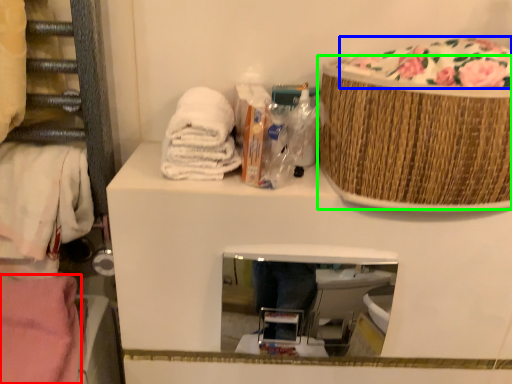
Question: Which object is the closest to the material (highlighted by a red box)? Choose among these: food (highlighted by a blue box) or basket (highlighted by a green box).

Choices:
 (A) food
 (B) basket

Answer: (B)